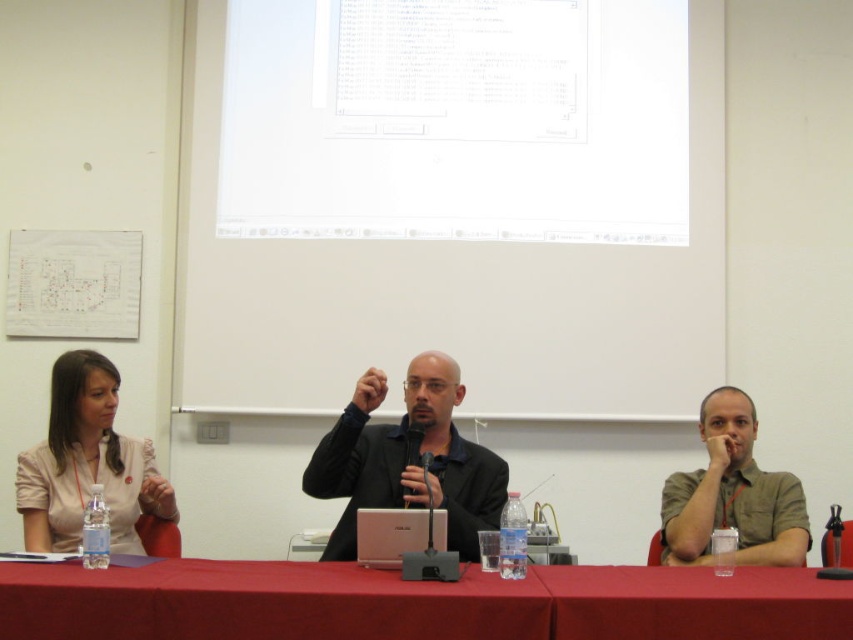
Question: Does green cotton shirt at center appear on the right side of black plastic microphone at center?

Choices:
 (A) yes
 (B) no

Answer: (A)

Question: Is red fabric table at lower center closer to the viewer compared to matte pink blouse at left?

Choices:
 (A) no
 (B) yes

Answer: (B)

Question: Does black matte jacket at center have a greater width compared to red fabric table at lower center?

Choices:
 (A) yes
 (B) no

Answer: (B)

Question: Which object is the closest to the red fabric table at center?

Choices:
 (A) matte pink blouse at left
 (B) black matte jacket at center

Answer: (B)

Question: Which is farther from the red fabric table at lower center?

Choices:
 (A) silver metallic laptop at center
 (B) black matte jacket at center

Answer: (B)

Question: Which is nearer to the black plastic microphone at center?

Choices:
 (A) silver metallic laptop at center
 (B) green cotton shirt at center
 (C) matte pink blouse at left
 (D) red fabric table at center

Answer: (A)